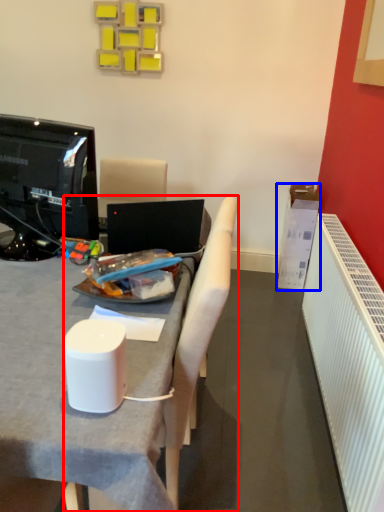
Question: Which object appears closest to the camera in this image, chair (highlighted by a red box) or box (highlighted by a blue box)?

Choices:
 (A) chair
 (B) box

Answer: (A)